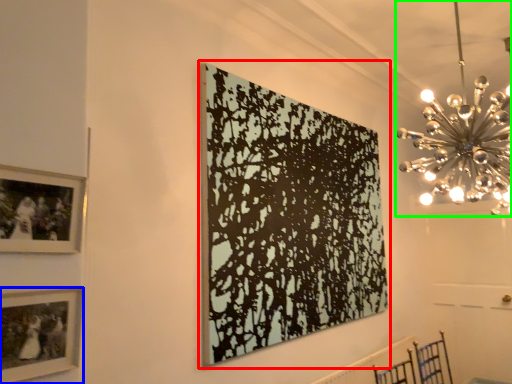
Question: Considering the real-world distances, which object is closest to picture frame (highlighted by a red box)? picture frame (highlighted by a blue box) or chandelier (highlighted by a green box).

Choices:
 (A) picture frame
 (B) chandelier

Answer: (B)